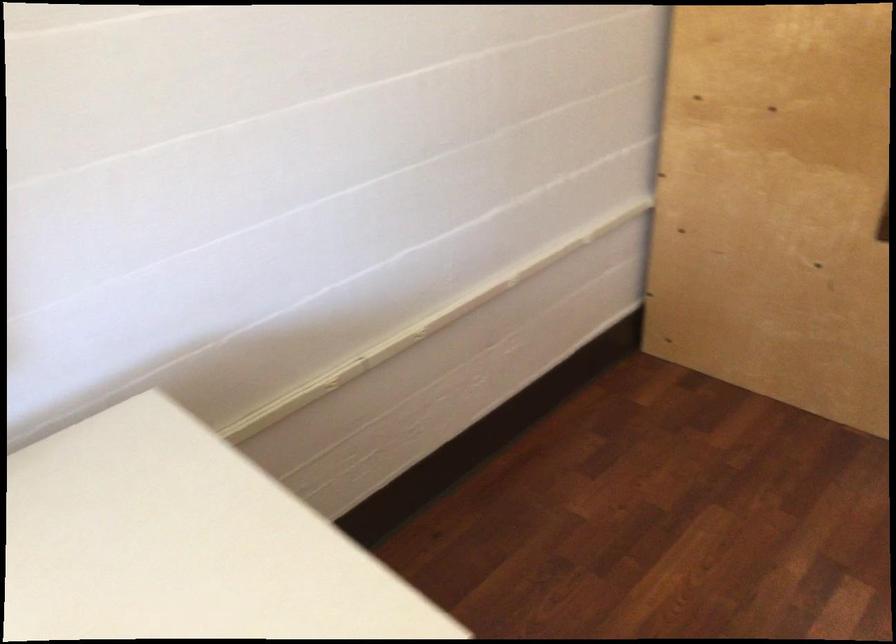
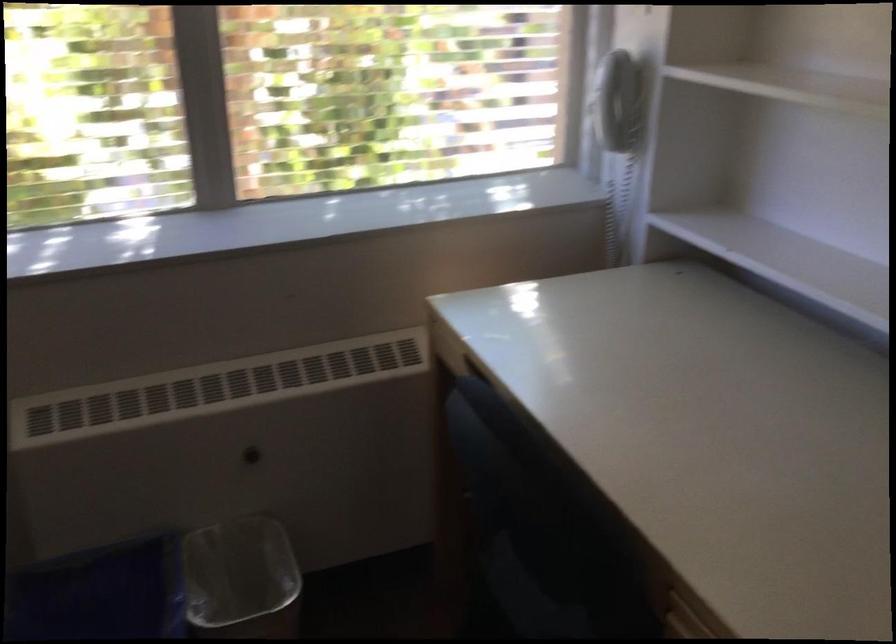
The images are taken continuously from a first-person perspective. In which direction is your viewpoint rotating?

The camera rotated toward left-down.